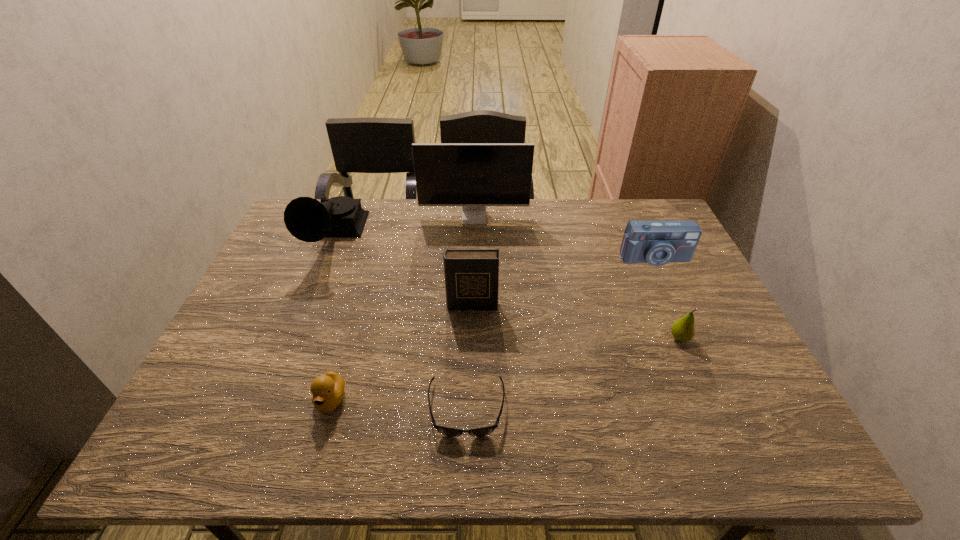
Select which object appears as the closest to the fifth farthest object. Please provide its 2D coordinates. Your answer should be formatted as a tuple, i.e. [(x, y)], where the tuple contains the x and y coordinates of a point satisfying the conditions above.

[(657, 243)]